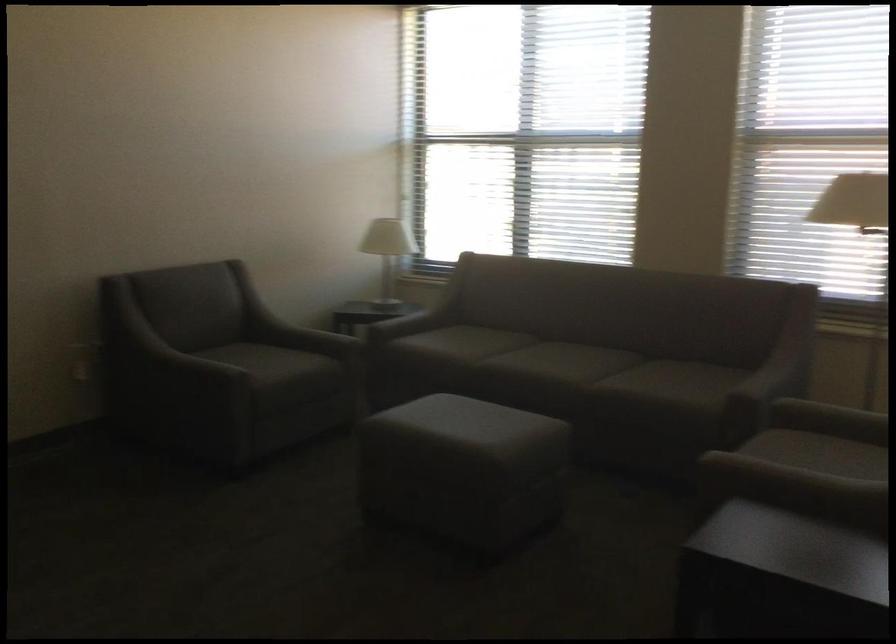
Find where to resting arm the sofa armrest. Please return your answer as a coordinate pair (x, y).

(762, 381)